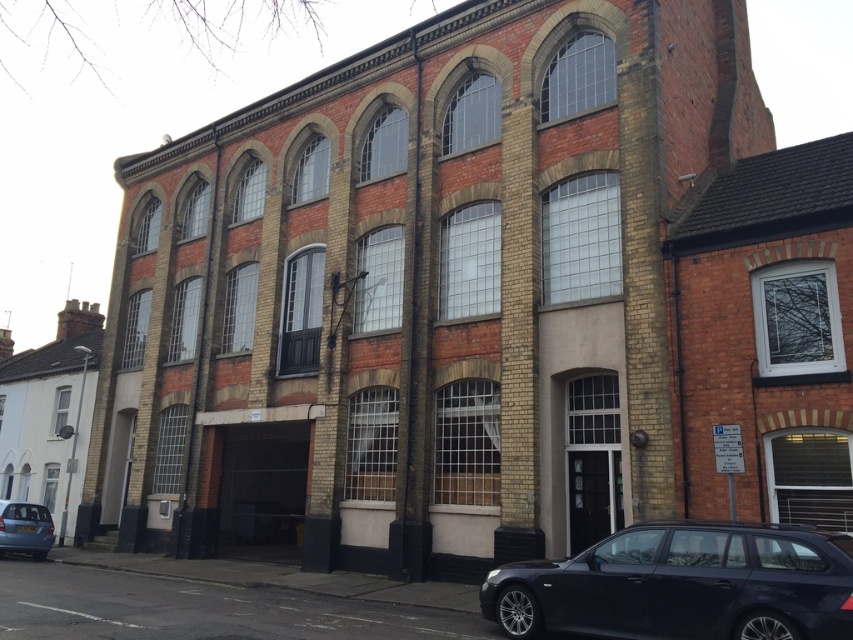
Question: Which of the following is the farthest from the observer?

Choices:
 (A) 16,525
 (B) 763,586

Answer: (A)

Question: Which object is closer to the camera taking this photo?

Choices:
 (A) matte blue hatchback at lower left
 (B) matte black car at lower right

Answer: (B)

Question: Does matte black car at lower right come in front of matte blue hatchback at lower left?

Choices:
 (A) no
 (B) yes

Answer: (B)

Question: Is matte black car at lower right closer to camera compared to matte blue hatchback at lower left?

Choices:
 (A) no
 (B) yes

Answer: (B)

Question: Does matte black car at lower right lie behind matte blue hatchback at lower left?

Choices:
 (A) no
 (B) yes

Answer: (A)

Question: Which of the following is the closest to the observer?

Choices:
 (A) matte black car at lower right
 (B) matte blue hatchback at lower left

Answer: (A)